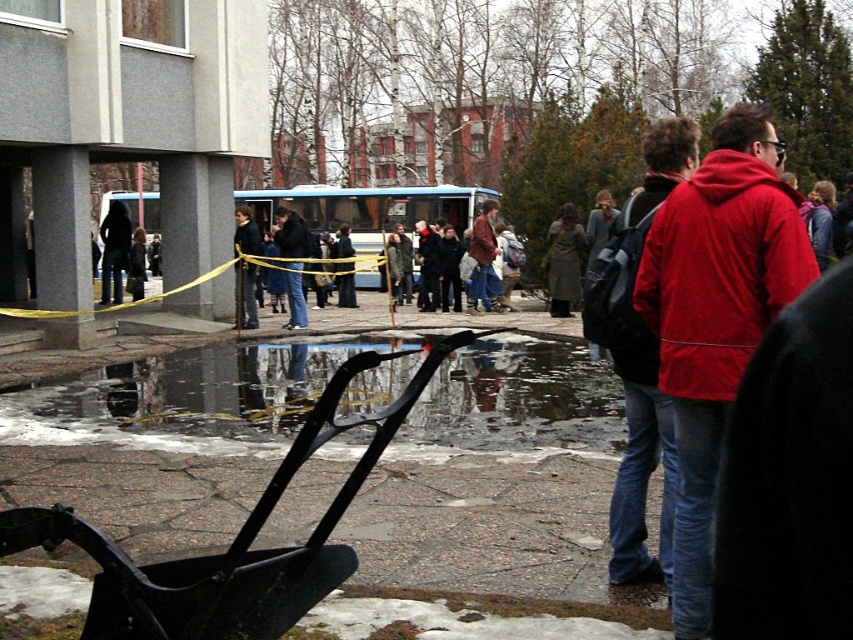
Question: Which of the following is the closest to the observer?

Choices:
 (A) dark wool coat at left
 (B) black plastic baby carriage at lower center
 (C) brown woolen coat at center

Answer: (B)

Question: From the image, what is the correct spatial relationship of black rubber water at lower center in relation to dark blue jeans at center?

Choices:
 (A) right
 (B) left

Answer: (A)

Question: Which object is the farthest from the jeans at center?

Choices:
 (A) black plastic baby carriage at lower center
 (B) dark wool coat at left

Answer: (A)

Question: Can you confirm if brown woolen coat at center is positioned to the left of dark wool coat at left?

Choices:
 (A) no
 (B) yes

Answer: (A)

Question: Among these points, which one is farthest from the camera?

Choices:
 (A) tap(259, 234)
 (B) tap(408, 408)
 (C) tap(674, 433)

Answer: (A)

Question: Does red matte jacket at center appear on the right side of dark wool coat at left?

Choices:
 (A) no
 (B) yes

Answer: (B)